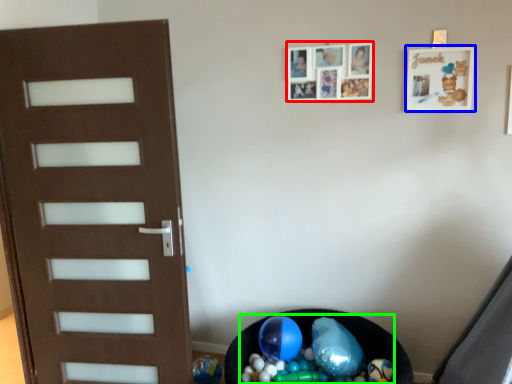
Question: Which object is the closest to the picture frame (highlighted by a red box)? Choose among these: picture frame (highlighted by a blue box) or garbage (highlighted by a green box).

Choices:
 (A) picture frame
 (B) garbage

Answer: (A)